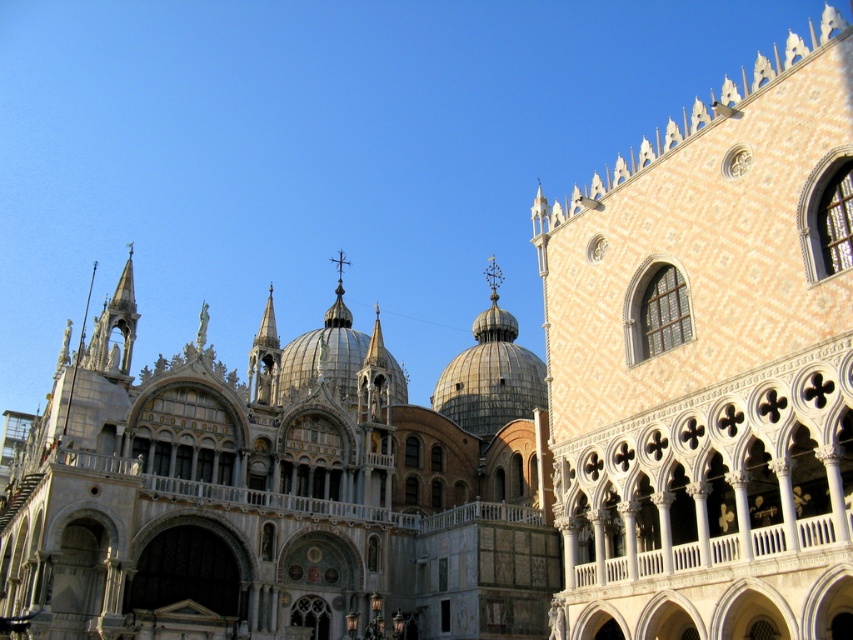
Does white textured building at upper right appear on the left side of white marble church at center?

Incorrect, white textured building at upper right is not on the left side of white marble church at center.

Who is shorter, white textured building at upper right or white marble church at center?

white marble church at center is shorter.

Measure the distance between point (844, 243) and camera.

They are 40.20 meters apart.

Find the location of a particular element. The width and height of the screenshot is (853, 640). white textured building at upper right is located at coordinates pos(709,365).